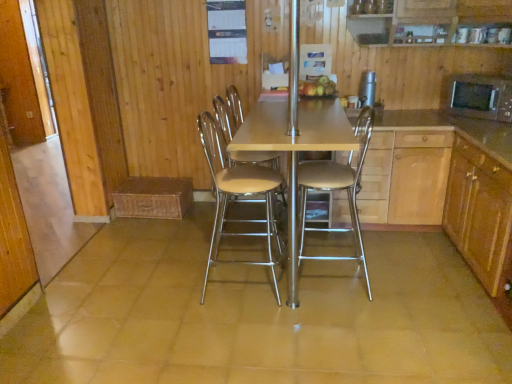
Locate an element on the screen. vacant space in between metallic beige stool at center, arranged as the second chair when viewed from the left, and matte wooden table at center is located at coordinates (350, 261).